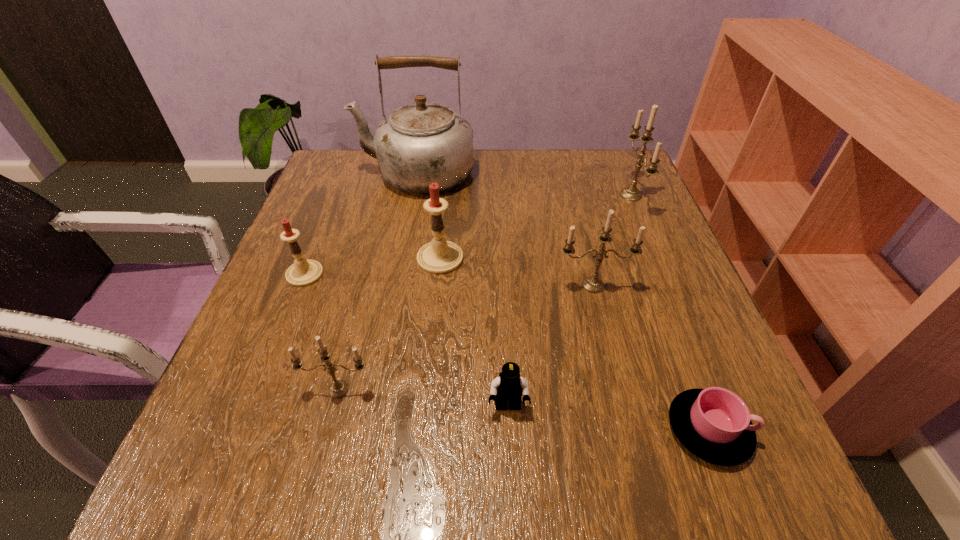
The width and height of the screenshot is (960, 540). Identify the location of the smallest metallic candle. (339, 388).

Where is `black Lego`? The height and width of the screenshot is (540, 960). black Lego is located at coordinates (509, 385).

I want to click on the seventh tallest object, so click(509, 385).

I want to click on cup, so click(714, 424).

Identify the location of the shortest object. (714, 424).

Image resolution: width=960 pixels, height=540 pixels. Identify the location of free location located 0.090m on the front of the seventh shortest object. (651, 244).

You are a GUI agent. You are given a task and a screenshot of the screen. Output one action in this format:
    pyautogui.click(x=<x>, y=<y>)
    Task: Click on the vacant space located 0.100m on the right of the third candle from right to left
    The image size is (960, 540).
    Given the screenshot: What is the action you would take?
    click(512, 258)

Identify the location of vacant region located on the back of the second farthest metallic candle. The height and width of the screenshot is (540, 960). (576, 216).

Where is `free spot located 0.150m on the right of the leftmost candle`? The image size is (960, 540). free spot located 0.150m on the right of the leftmost candle is located at coordinates (398, 274).

This screenshot has width=960, height=540. What are the coordinates of `free space located on the right of the nearest candle` in the screenshot? It's located at (506, 389).